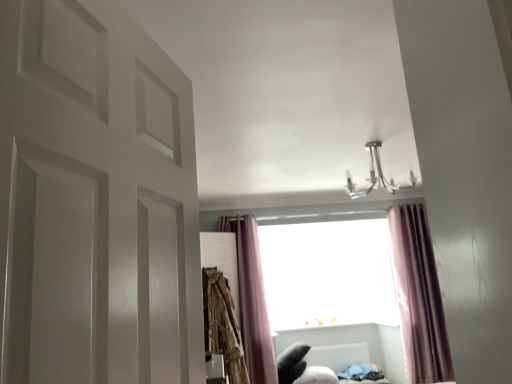
Question: Would you say purple velvet curtain at center, the 1th curtain in the right-to-left sequence, is a long distance from purple velvet curtain at center, positioned as the second curtain in right-to-left order?

Choices:
 (A) no
 (B) yes

Answer: (B)

Question: Does purple velvet curtain at center, the 2th curtain viewed from the left, lie behind purple velvet curtain at center, placed as the 1th curtain when sorted from left to right?

Choices:
 (A) yes
 (B) no

Answer: (A)

Question: Does purple velvet curtain at center, the 1th curtain in the right-to-left sequence, lie in front of purple velvet curtain at center, placed as the 1th curtain when sorted from left to right?

Choices:
 (A) no
 (B) yes

Answer: (A)

Question: Can you confirm if purple velvet curtain at center, the 1th curtain in the right-to-left sequence, is wider than purple velvet curtain at center, positioned as the second curtain in right-to-left order?

Choices:
 (A) no
 (B) yes

Answer: (B)

Question: From a real-world perspective, is purple velvet curtain at center, the 1th curtain in the right-to-left sequence, positioned over purple velvet curtain at center, positioned as the second curtain in right-to-left order, based on gravity?

Choices:
 (A) no
 (B) yes

Answer: (A)

Question: From the image's perspective, relative to textured beige robe at center-left, is purple velvet curtain at center, placed as the 1th curtain when sorted from left to right, above or below?

Choices:
 (A) above
 (B) below

Answer: (A)

Question: Is purple velvet curtain at center, placed as the 1th curtain when sorted from left to right, inside or outside of textured beige robe at center-left?

Choices:
 (A) inside
 (B) outside

Answer: (B)

Question: Looking at their shapes, would you say purple velvet curtain at center, placed as the 1th curtain when sorted from left to right, is wider or thinner than textured beige robe at center-left?

Choices:
 (A) wide
 (B) thin

Answer: (B)

Question: From a real-world perspective, is purple velvet curtain at center, positioned as the second curtain in right-to-left order, physically located above or below textured beige robe at center-left?

Choices:
 (A) below
 (B) above

Answer: (B)

Question: From the image's perspective, is purple velvet curtain at center, the 1th curtain in the right-to-left sequence, located above or below white plastic radiator at lower center?

Choices:
 (A) above
 (B) below

Answer: (A)

Question: Considering the positions of purple velvet curtain at center, the 1th curtain in the right-to-left sequence, and white plastic radiator at lower center in the image, is purple velvet curtain at center, the 1th curtain in the right-to-left sequence, taller or shorter than white plastic radiator at lower center?

Choices:
 (A) short
 (B) tall

Answer: (B)

Question: Visually, is purple velvet curtain at center, the 1th curtain in the right-to-left sequence, positioned to the left or to the right of white plastic radiator at lower center?

Choices:
 (A) left
 (B) right

Answer: (B)

Question: Choose the correct answer: Is purple velvet curtain at center, the 2th curtain viewed from the left, inside white plastic radiator at lower center or outside it?

Choices:
 (A) inside
 (B) outside

Answer: (B)

Question: From a real-world perspective, relative to transparent glass window at center, is purple velvet curtain at center, the 1th curtain in the right-to-left sequence, vertically above or below?

Choices:
 (A) below
 (B) above

Answer: (A)

Question: From the image's perspective, is purple velvet curtain at center, the 2th curtain viewed from the left, positioned above or below transparent glass window at center?

Choices:
 (A) above
 (B) below

Answer: (A)